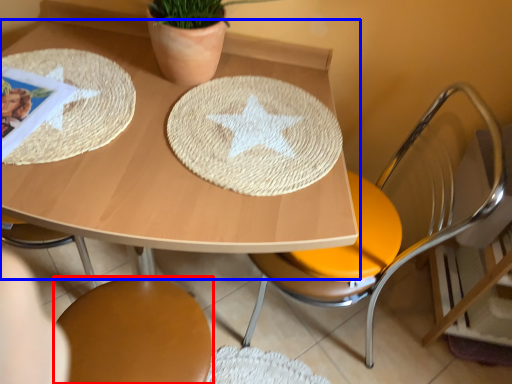
Question: Which of the following is the closest to the observer, chair (highlighted by a red box) or table (highlighted by a blue box)?

Choices:
 (A) chair
 (B) table

Answer: (B)